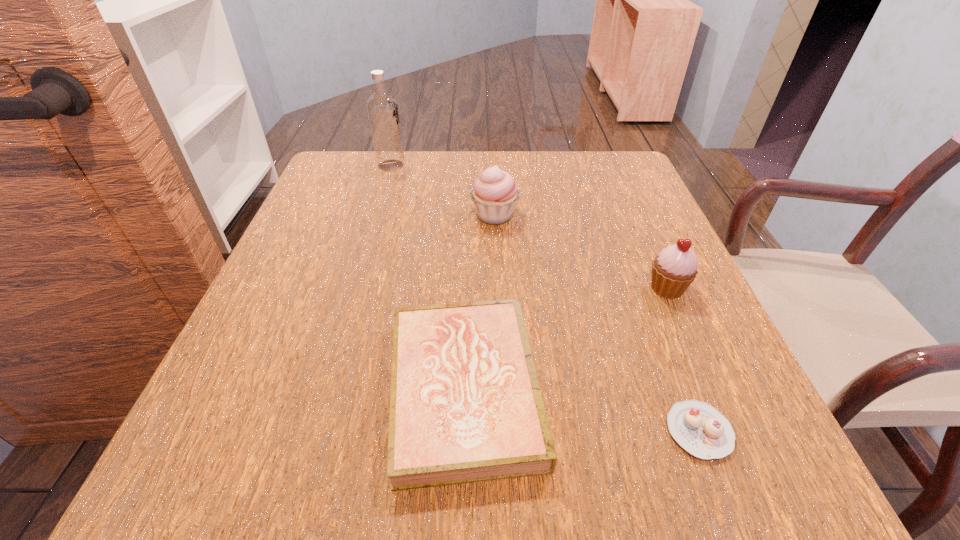
This screenshot has height=540, width=960. What are the coordinates of `free point located 0.210m on the left of the third farthest object` in the screenshot? It's located at (529, 288).

This screenshot has height=540, width=960. Identify the location of free space located on the back of the hardback book. (468, 248).

Locate an element on the screen. free region located 0.380m on the left of the shortest object is located at coordinates (386, 431).

Locate an element on the screen. The height and width of the screenshot is (540, 960). vodka at the far edge is located at coordinates (382, 108).

Find the location of `cupcake at the far edge`. cupcake at the far edge is located at coordinates (495, 193).

This screenshot has width=960, height=540. What are the coordinates of `hardback book that is at the near edge` in the screenshot? It's located at (465, 405).

Image resolution: width=960 pixels, height=540 pixels. I want to click on cupcake at the near edge, so click(x=700, y=429).

The image size is (960, 540). In order to click on object at the left edge in this screenshot , I will do `click(382, 108)`.

This screenshot has height=540, width=960. In order to click on object that is at the far left corner in this screenshot , I will do `click(382, 108)`.

The height and width of the screenshot is (540, 960). Identify the location of object that is at the near right corner. (700, 429).